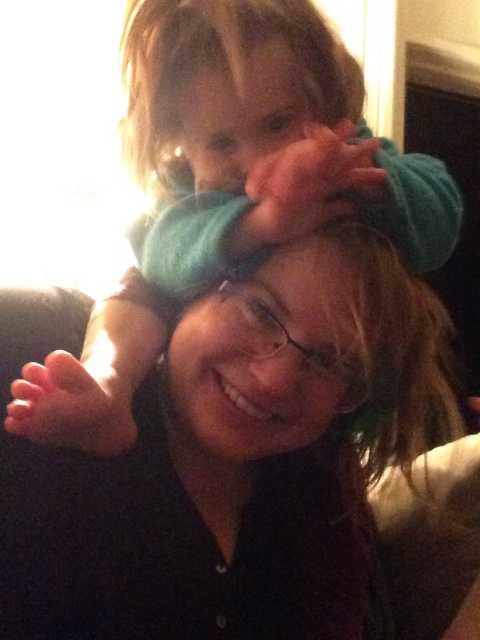
You are a photographer adjusting the lighting in the scene. You notice the matte blue beanie at upper center and the black fabric shoulder at upper right. Which object is covering part of the other?

The matte blue beanie at upper center is positioned over the black fabric shoulder at upper right, so it is covering part of it.

You are a photographer trying to capture a closeup shot of both the matte blue beanie at upper center and the matte blue beanie at center. Given that your camera can only focus on objects within a 3 inch range, will you be able to capture both beanies in focus?

The distance between the matte blue beanie at upper center and the matte blue beanie at center is 3.23 inches. Since the camera can only focus within a 3 inch range, the 3.23 inch gap exceeds this limit. Therefore, both beanies cannot be captured in focus simultaneously.